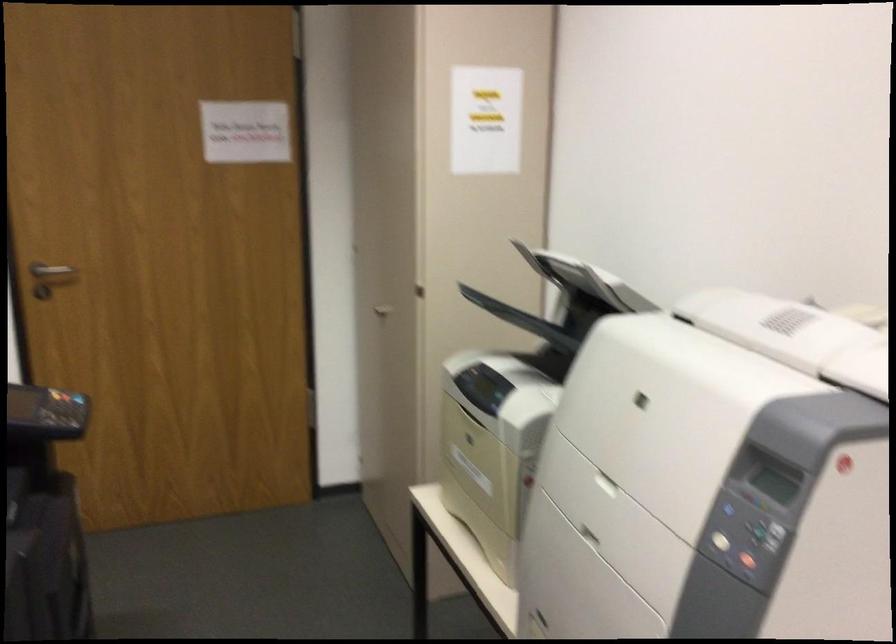
Find where to lift the printer lid. Please return your answer as a coordinate pair (x, y).

(581, 279)